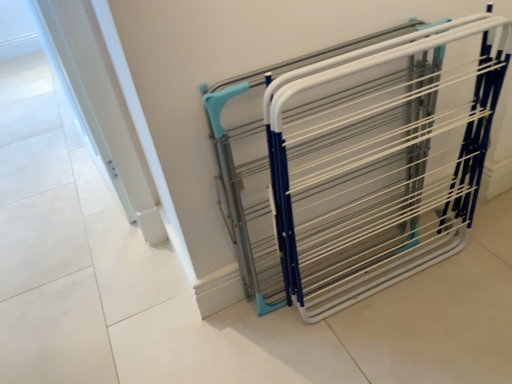
The image size is (512, 384). In order to click on free spot to the left of white metal gate at center in this screenshot , I will do click(x=245, y=338).